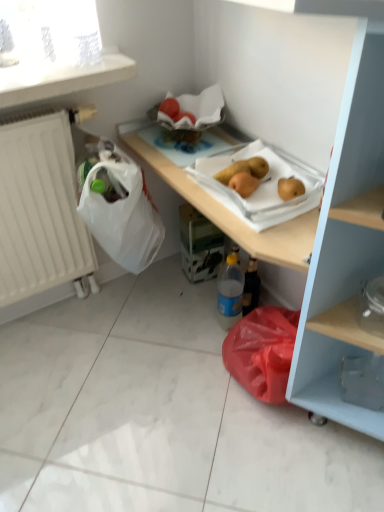
Where is `vacant space behind blue plastic bottle at lower center`? vacant space behind blue plastic bottle at lower center is located at coordinates (215, 296).